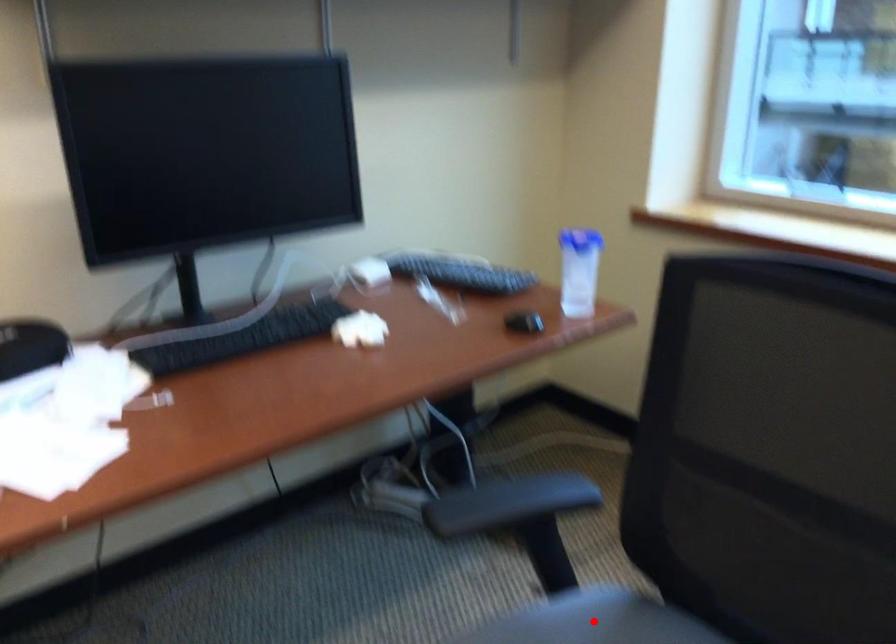
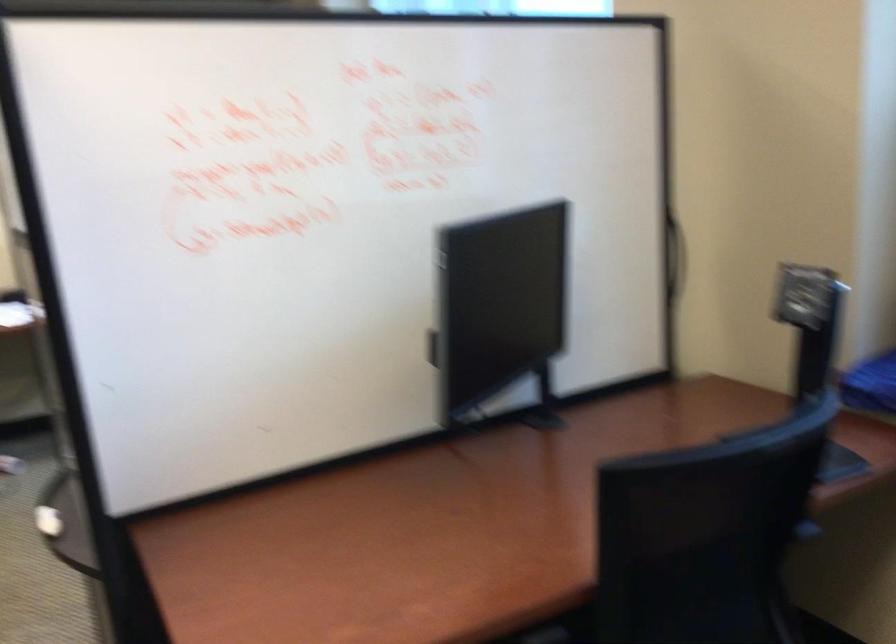
Question: I am providing you with two images of the same scene from different viewpoints. A red point is marked on the first image. At the location where the point appears in image 1, is it still visible in image 2?

Choices:
 (A) Yes
 (B) No

Answer: (B)